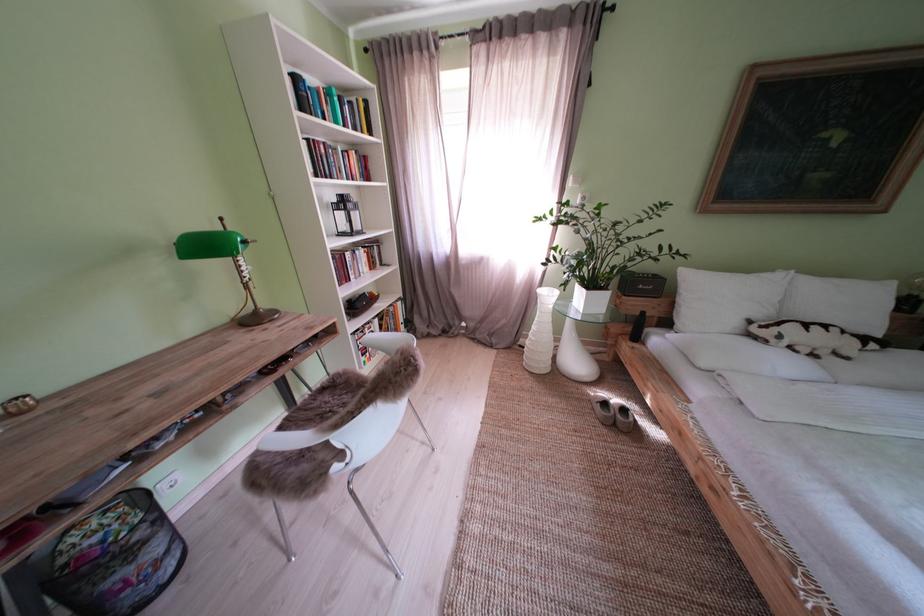
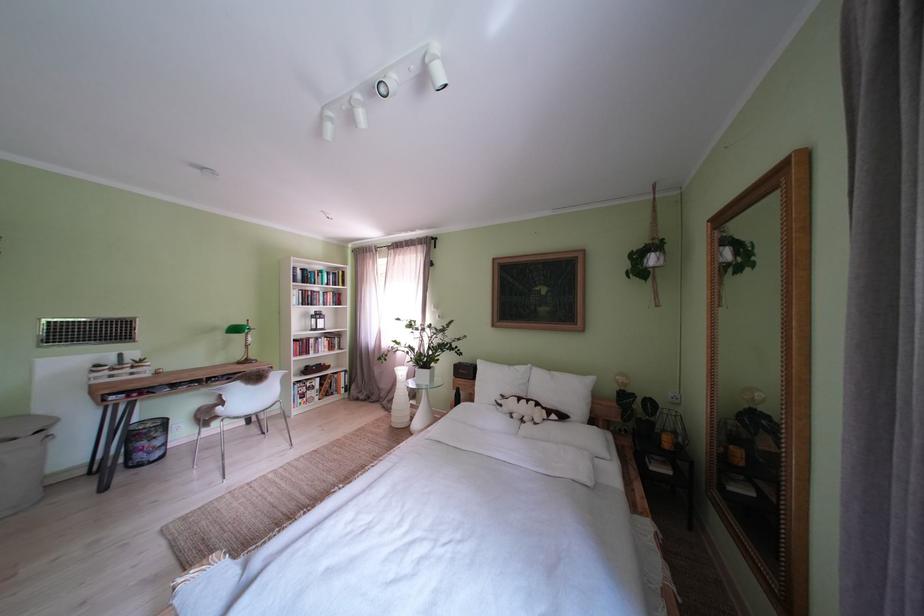
Find the pixel in the second image that matches [792,342] in the first image.

(512, 411)